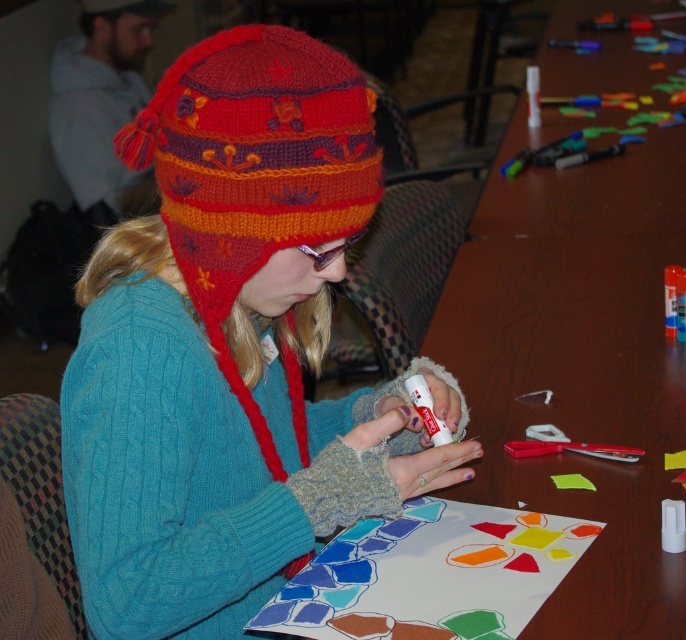
From the picture: You are organizing a craft workshop and need to place a knitted woolen hat at center on the wooden table at center. Will the hat fit entirely on the table?

The knitted woolen hat at center has a lesser width compared to the wooden table at center, so yes, the hat will fit entirely on the table.

You are looking at the craft table and see two points marked on the image. Which point, point [318,252] or point [591,248], is closer to you?

Point [318,252] is closer to the camera than point [591,248].